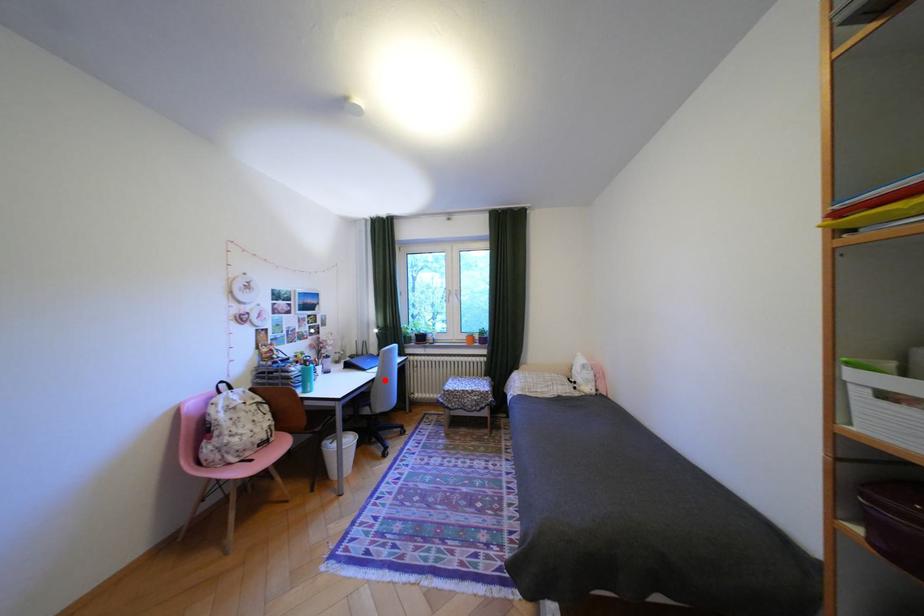
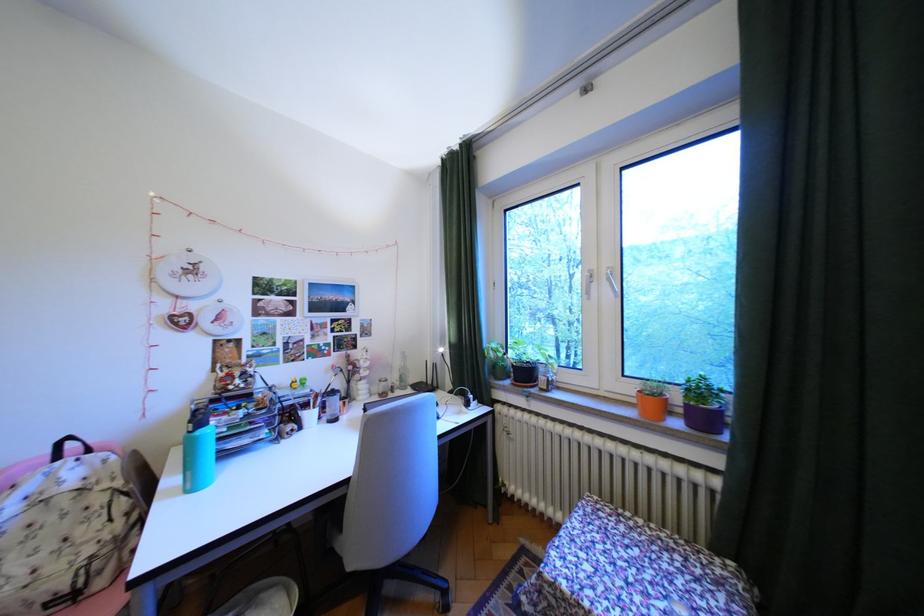
The point at the highlighted location is marked in the first image. Where is the corresponding point in the second image?

(359, 483)